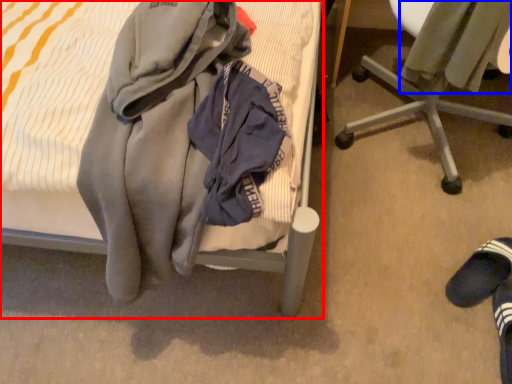
Question: Which of the following is the closest to the observer, bed (highlighted by a red box) or sweater (highlighted by a blue box)?

Choices:
 (A) bed
 (B) sweater

Answer: (A)